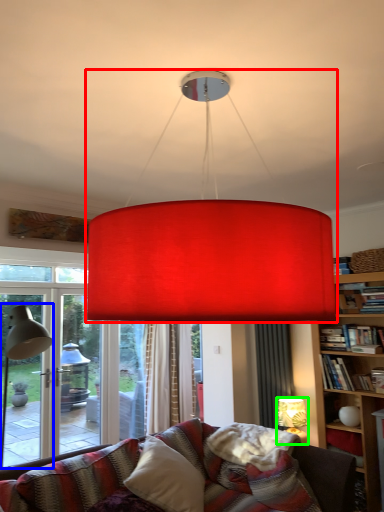
Question: Considering the real-world distances, which object is farthest from lamp (highlighted by a red box)? table lamp (highlighted by a blue box) or lamp (highlighted by a green box)?

Choices:
 (A) table lamp
 (B) lamp

Answer: (B)